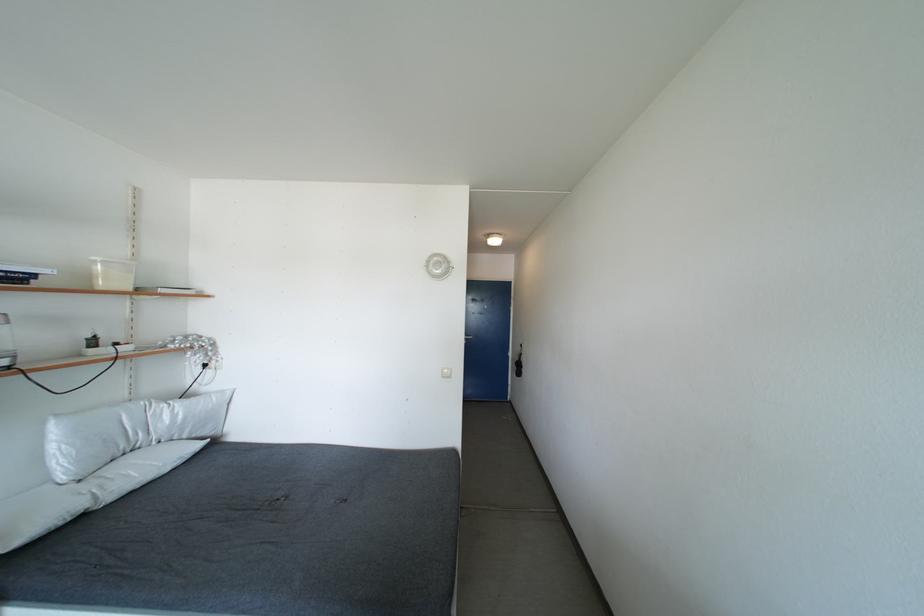
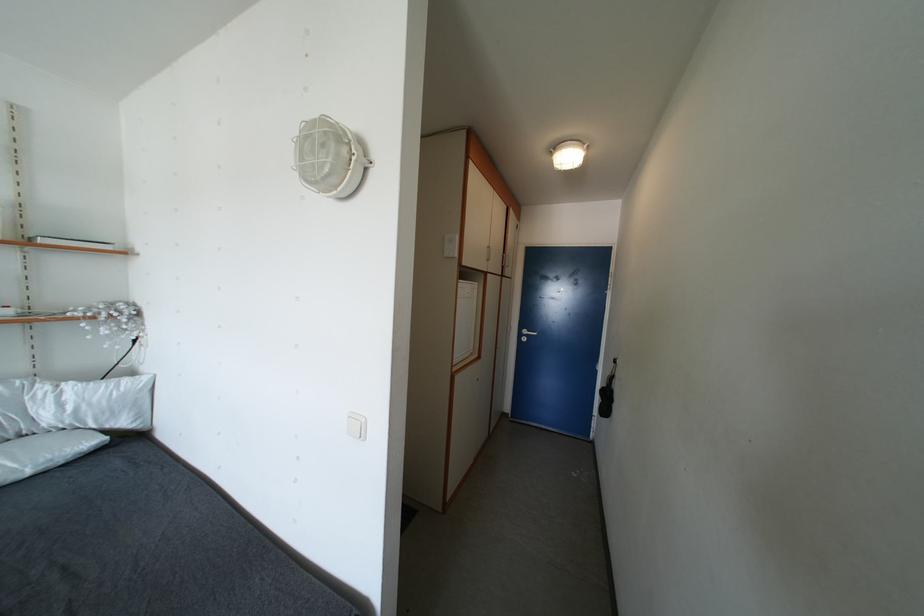
The images are taken continuously from a first-person perspective. In which direction are you moving?

The movement direction of the cameraman is right, forward.